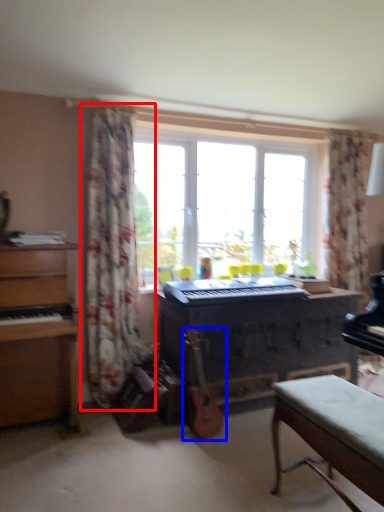
Question: Among these objects, which one is farthest to the camera, curtain (highlighted by a red box) or guitar (highlighted by a blue box)?

Choices:
 (A) curtain
 (B) guitar

Answer: (A)